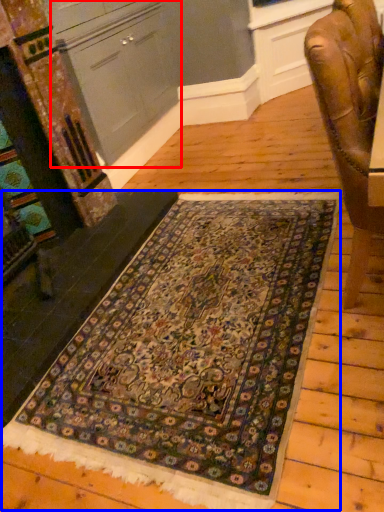
Question: Among these objects, which one is farthest to the camera, cabinetry (highlighted by a red box) or mat (highlighted by a blue box)?

Choices:
 (A) cabinetry
 (B) mat

Answer: (A)